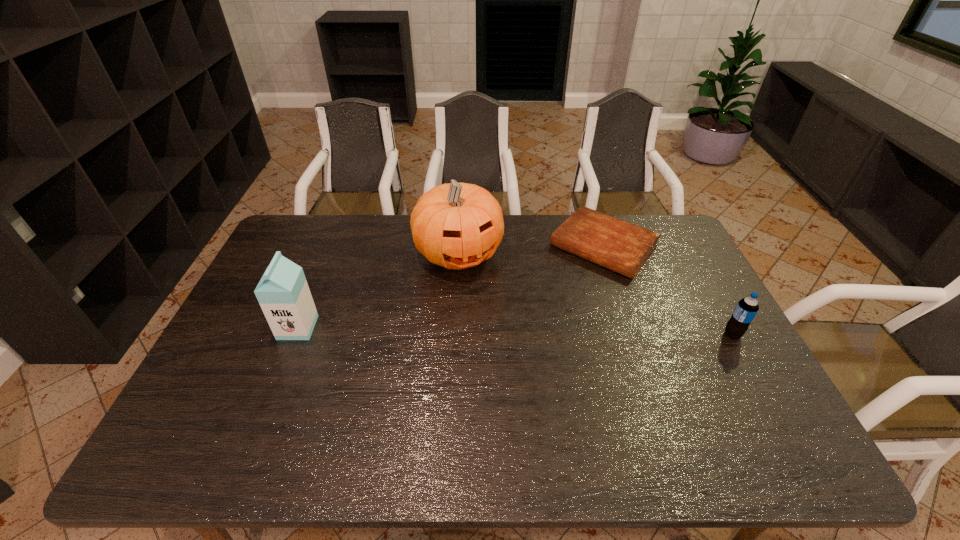
Locate an element on the screen. The width and height of the screenshot is (960, 540). vacant space positioned 0.220m on the spine side of the shortest object is located at coordinates (542, 314).

Find the location of `free point located on the spine side of the shortest object`. free point located on the spine side of the shortest object is located at coordinates (509, 353).

What are the coordinates of `vacant area situated 0.300m on the spine side of the shortest object` in the screenshot? It's located at (528, 330).

Where is `free space located 0.360m on the front-facing side of the pumpkin`? The height and width of the screenshot is (540, 960). free space located 0.360m on the front-facing side of the pumpkin is located at coordinates (523, 368).

What are the coordinates of `vacant space located on the front-facing side of the pumpkin` in the screenshot? It's located at (526, 374).

Locate an element on the screen. The image size is (960, 540). vacant point located on the front-facing side of the pumpkin is located at coordinates (490, 309).

Locate an element on the screen. This screenshot has height=540, width=960. Bible that is positioned at the far edge is located at coordinates (620, 246).

I want to click on pumpkin positioned at the far edge, so click(x=457, y=226).

I want to click on object that is at the left edge, so click(x=283, y=293).

Locate an element on the screen. soda bottle located at the right edge is located at coordinates (746, 309).